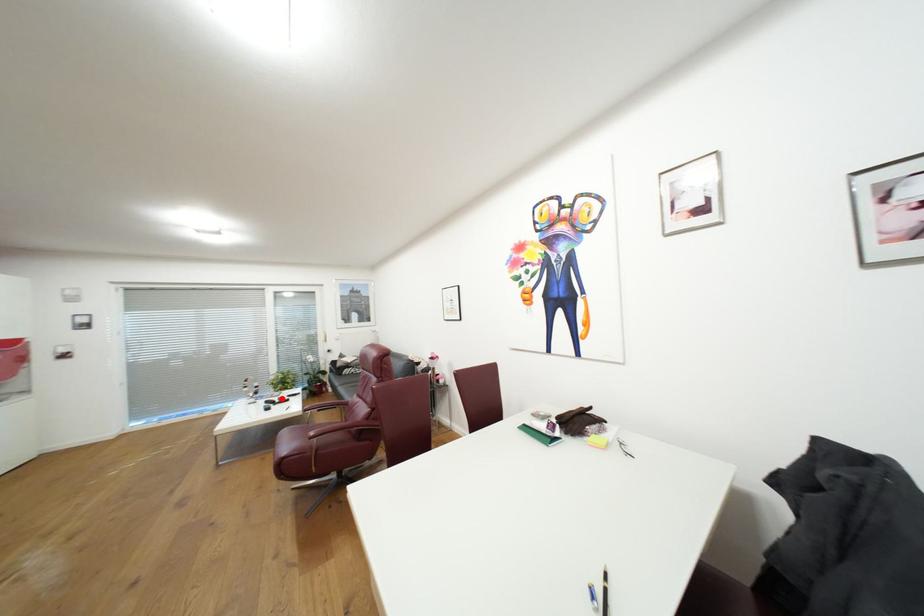
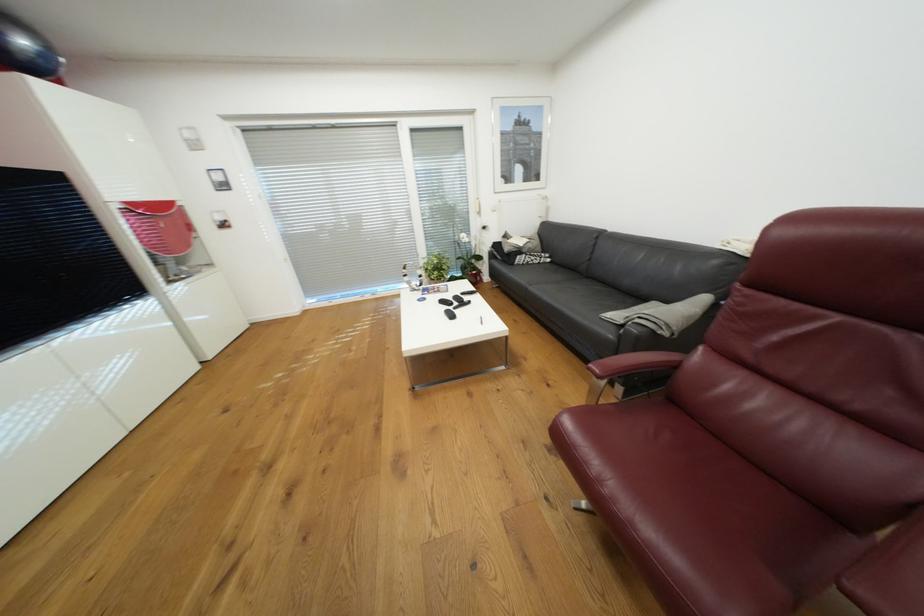
Question: I am providing you with two images of the same scene from different viewpoints. In image1, a red point is highlighted. Considering the same 3D point in image2, which of the following is correct?

Choices:
 (A) It is closer
 (B) It is farther

Answer: (B)